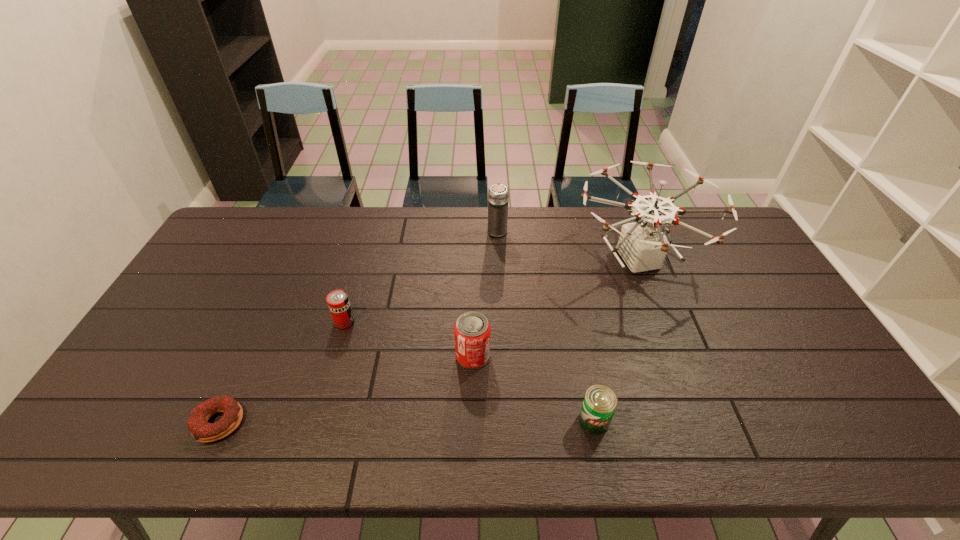
This screenshot has height=540, width=960. In order to click on drone in this screenshot , I will do `click(642, 245)`.

Find the location of a particular element. This screenshot has height=540, width=960. the fifth shortest object is located at coordinates (498, 195).

Image resolution: width=960 pixels, height=540 pixels. In order to click on the second can from left to right in this screenshot , I will do `click(472, 331)`.

Image resolution: width=960 pixels, height=540 pixels. I want to click on the tallest can, so click(x=472, y=331).

Where is `the fourth nearest object`? The image size is (960, 540). the fourth nearest object is located at coordinates (338, 302).

Find the location of `the leftmost can`. the leftmost can is located at coordinates coord(338,302).

This screenshot has height=540, width=960. Identify the location of the nearest can. pyautogui.click(x=600, y=402).

Where is `doughnut`? doughnut is located at coordinates (200, 429).

Find the location of a particular element. The width and height of the screenshot is (960, 540). the leftmost object is located at coordinates (200, 429).

In order to click on blank space located on the left of the tallest object in this screenshot , I will do `click(532, 260)`.